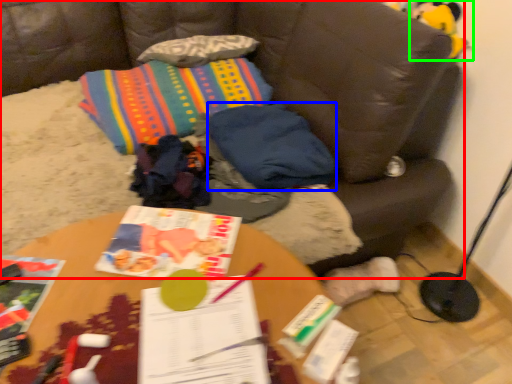
Question: Which object is positioned farthest from studio couch (highlighted by a red box)? Select from pillow (highlighted by a blue box) and toy (highlighted by a green box).

Choices:
 (A) pillow
 (B) toy

Answer: (B)